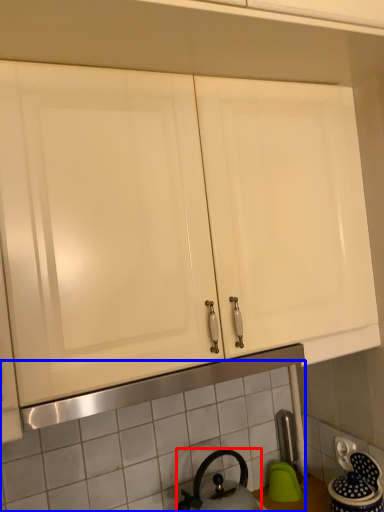
Question: Among these objects, which one is farthest to the camera, kettle (highlighted by a red box) or tile (highlighted by a blue box)?

Choices:
 (A) kettle
 (B) tile

Answer: (B)